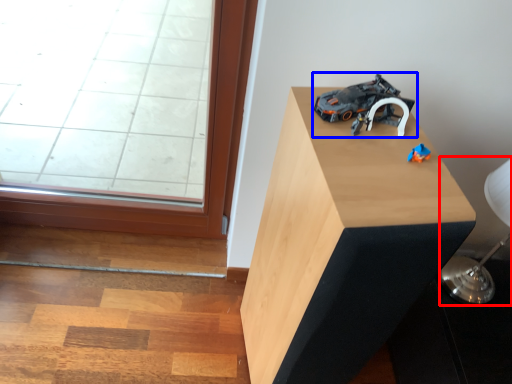
Question: Which of the following is the closest to the observer, table lamp (highlighted by a red box) or toy (highlighted by a blue box)?

Choices:
 (A) table lamp
 (B) toy

Answer: (B)